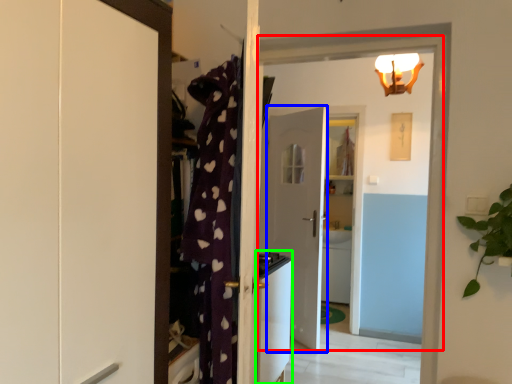
Question: Based on their relative distances, which object is nearer to door (highlighted by a red box)? Choose from door (highlighted by a blue box) and appliance (highlighted by a green box).

Choices:
 (A) door
 (B) appliance

Answer: (B)